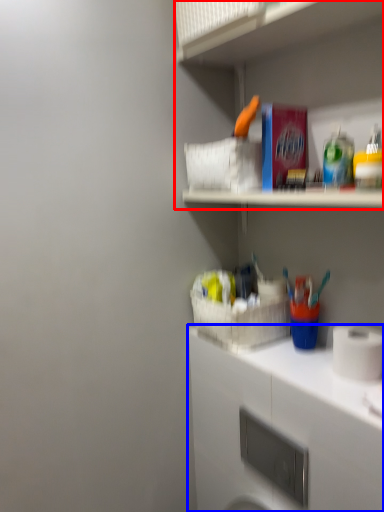
Question: Among these objects, which one is nearest to the camera, shelf (highlighted by a red box) or cabinetry (highlighted by a blue box)?

Choices:
 (A) shelf
 (B) cabinetry

Answer: (A)